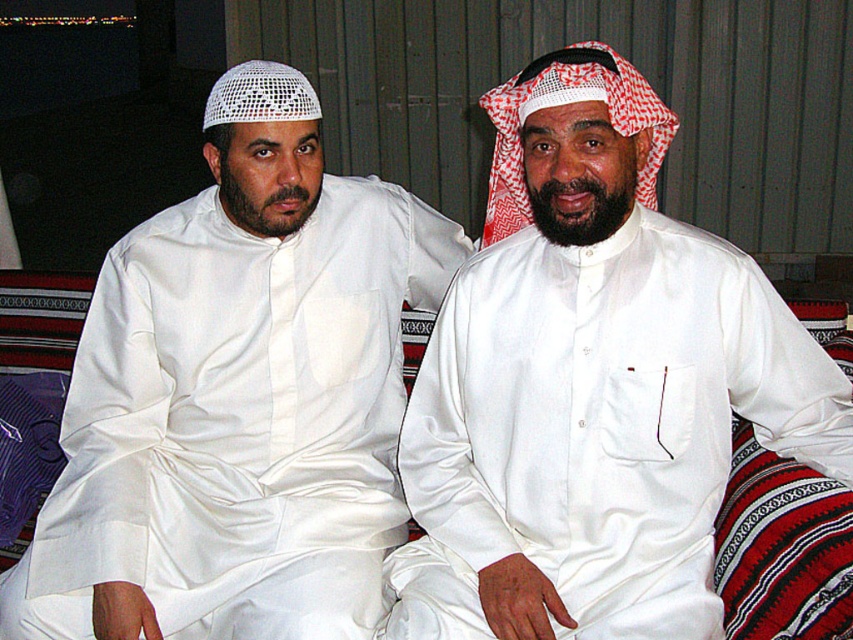
What do you see at coordinates (592, 385) in the screenshot?
I see `white satin kandura at center` at bounding box center [592, 385].

Is white satin kandura at center positioned before white satin kandura at left?

Yes, white satin kandura at center is in front of white satin kandura at left.

At what (x,y) coordinates should I click in order to perform the action: click on white satin kandura at center. Please return your answer as a coordinate pair (x, y). The image size is (853, 640). Looking at the image, I should click on (592, 385).

Identify the location of white satin kandura at center. This screenshot has width=853, height=640. (592, 385).